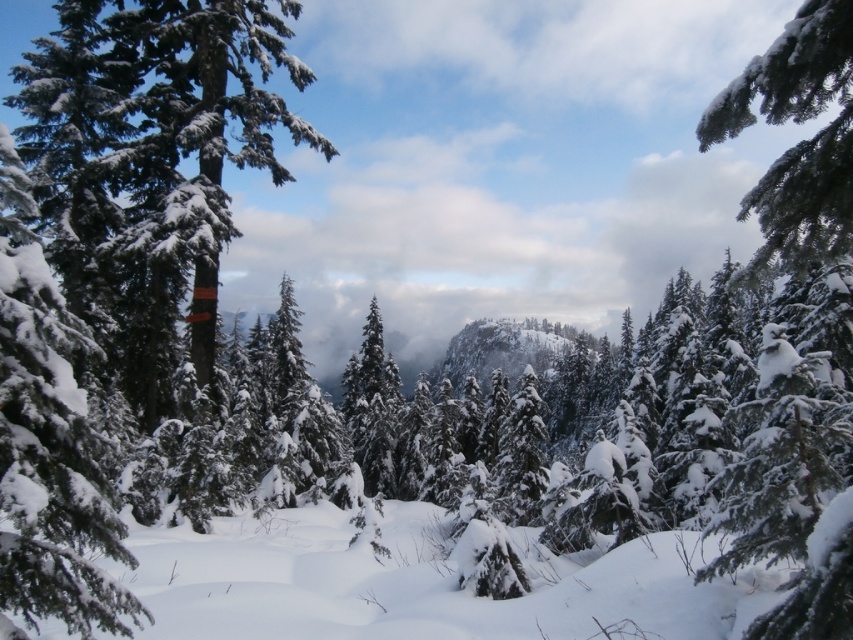
Between point (392, 563) and point (822, 179), which one is positioned behind?

Positioned behind is point (392, 563).

Who is more forward, (403,502) or (838,234)?

Point (838,234) is more forward.

Find the location of a particular element. white fluffy snow at center is located at coordinates (422, 582).